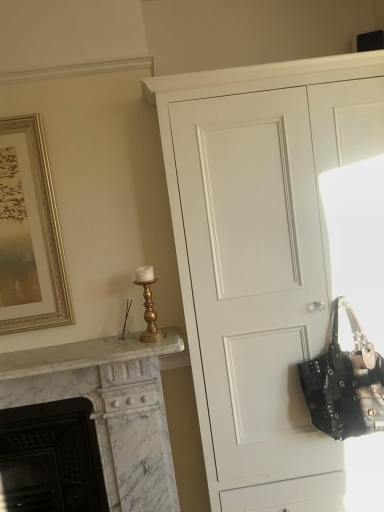
Question: Is white marble fireplace at left, placed as the second fireplace when sorted from left to right, not near white matte cupboard at center?

Choices:
 (A) yes
 (B) no

Answer: (B)

Question: Does white marble fireplace at left, placed as the second fireplace when sorted from left to right, have a lesser width compared to white matte cupboard at center?

Choices:
 (A) no
 (B) yes

Answer: (B)

Question: Is white marble fireplace at left, which is counted as the first fireplace, starting from the right, closer to the viewer compared to white matte cupboard at center?

Choices:
 (A) yes
 (B) no

Answer: (B)

Question: Considering the relative sizes of white marble fireplace at left, placed as the second fireplace when sorted from left to right, and white matte cupboard at center in the image provided, is white marble fireplace at left, placed as the second fireplace when sorted from left to right, taller than white matte cupboard at center?

Choices:
 (A) yes
 (B) no

Answer: (B)

Question: Does white marble fireplace at left, which is counted as the first fireplace, starting from the right, have a smaller size compared to white matte cupboard at center?

Choices:
 (A) no
 (B) yes

Answer: (B)

Question: Is white marble fireplace at left, placed as the second fireplace when sorted from left to right, not inside white matte cupboard at center?

Choices:
 (A) yes
 (B) no

Answer: (A)

Question: Is gold framed picture at upper left at the right side of studded leather handbag at right?

Choices:
 (A) yes
 (B) no

Answer: (B)

Question: Is gold framed picture at upper left placed right next to studded leather handbag at right?

Choices:
 (A) no
 (B) yes

Answer: (A)

Question: Is gold framed picture at upper left to the left of studded leather handbag at right from the viewer's perspective?

Choices:
 (A) yes
 (B) no

Answer: (A)

Question: Is gold framed picture at upper left outside of studded leather handbag at right?

Choices:
 (A) yes
 (B) no

Answer: (A)

Question: Is gold framed picture at upper left shorter than studded leather handbag at right?

Choices:
 (A) yes
 (B) no

Answer: (B)

Question: Is gold framed picture at upper left thinner than studded leather handbag at right?

Choices:
 (A) no
 (B) yes

Answer: (B)

Question: Is the position of gold metallic candlestick at upper left more distant than that of white matte cupboard at center?

Choices:
 (A) no
 (B) yes

Answer: (B)